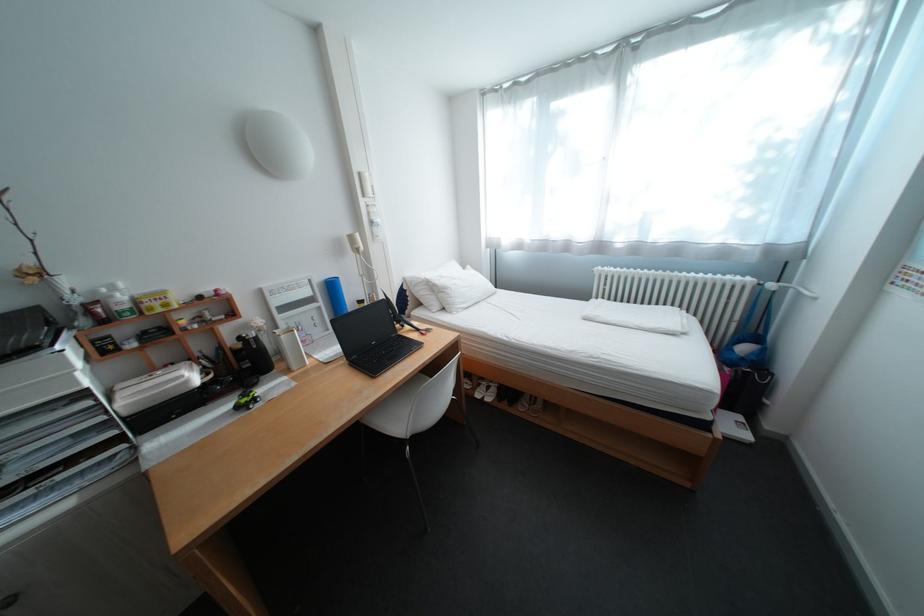
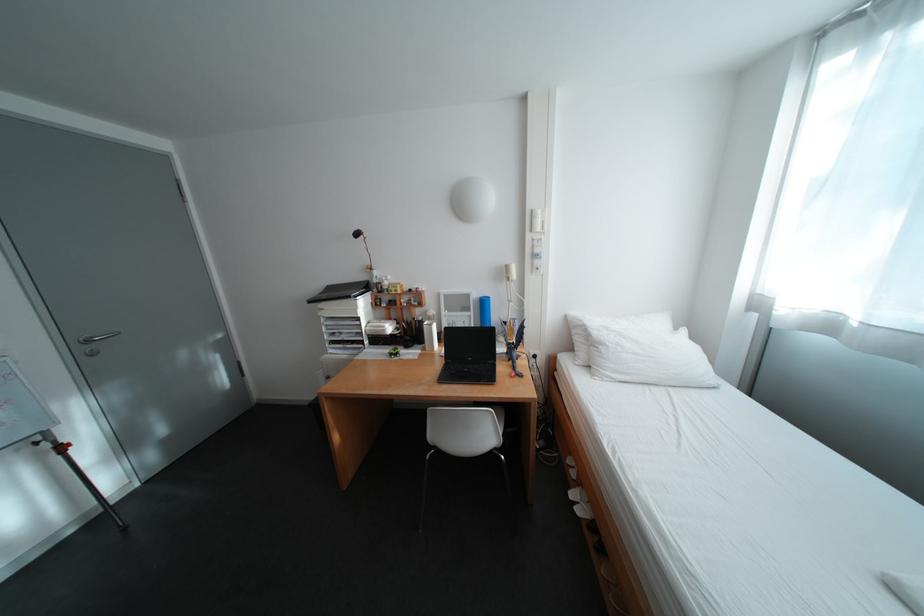
Locate, in the second image, the point that corresponds to (385,344) in the first image.

(481, 360)